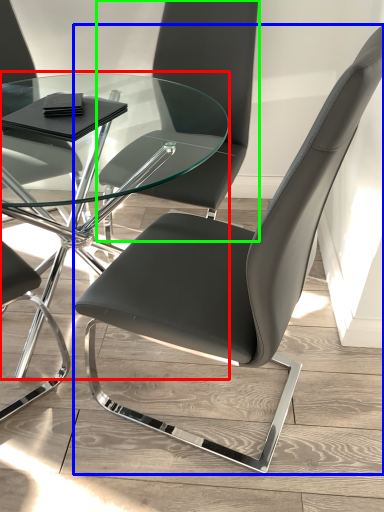
Question: Based on their relative distances, which object is farther from table (highlighted by a red box)? Choose from chair (highlighted by a blue box) and chair (highlighted by a green box).

Choices:
 (A) chair
 (B) chair

Answer: (A)